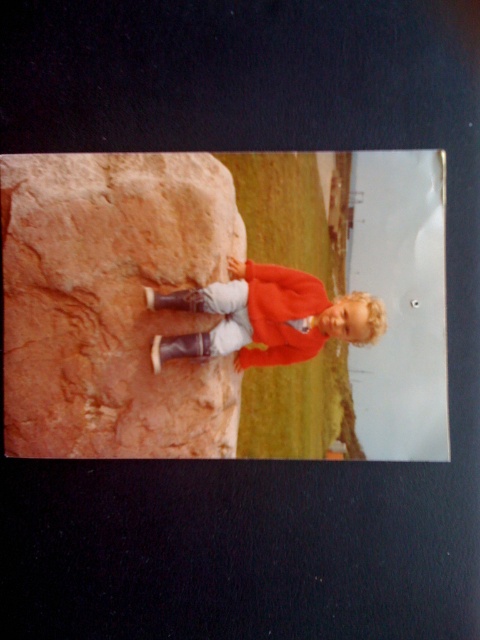
Question: Is rustic brown rock at left behind matte red jacket at center?

Choices:
 (A) no
 (B) yes

Answer: (A)

Question: Does rustic brown rock at left lie behind matte red jacket at center?

Choices:
 (A) yes
 (B) no

Answer: (B)

Question: Which point is closer to the camera?

Choices:
 (A) matte red jacket at center
 (B) rustic brown rock at left

Answer: (B)

Question: Is rustic brown rock at left wider than matte red jacket at center?

Choices:
 (A) no
 (B) yes

Answer: (A)

Question: Which point is farther to the camera?

Choices:
 (A) rustic brown rock at left
 (B) matte red jacket at center

Answer: (B)

Question: Which point is closer to the camera?

Choices:
 (A) (17, 428)
 (B) (276, 323)

Answer: (A)